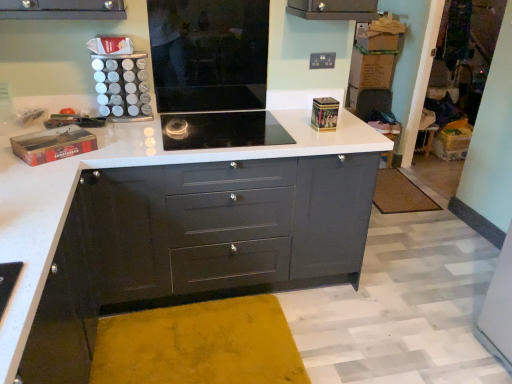
The image size is (512, 384). I want to click on brown textured mat at lower right, so click(x=400, y=194).

I want to click on black glass cooktop at center, so click(209, 54).

Measure the distance between point [323,209] and camera.

2.08 meters.

At what (x,y) coordinates should I click in order to perform the action: click on black glass cooktop at center. Please return your answer as a coordinate pair (x, y). Looking at the image, I should click on (222, 130).

Locate an element on the screen. This screenshot has height=384, width=512. brown textured mat at lower right is located at coordinates (400, 194).

Is matte black chest of drawers at center thinner than brown textured mat at lower right?

No, matte black chest of drawers at center is not thinner than brown textured mat at lower right.

Is matte black chest of drawers at center at the left side of brown textured mat at lower right?

Indeed, matte black chest of drawers at center is positioned on the left side of brown textured mat at lower right.

From the image's perspective, is matte black chest of drawers at center located above brown textured mat at lower right?

No, from the image's perspective, matte black chest of drawers at center is not above brown textured mat at lower right.

Is matte black chest of drawers at center directly adjacent to brown textured mat at lower right?

No, matte black chest of drawers at center is not next to brown textured mat at lower right.

Is black glass cooktop at center completely or partially outside of black glass cooktop at center?

That's correct, black glass cooktop at center is outside of black glass cooktop at center.

From the image's perspective, between black glass cooktop at center and black glass cooktop at center, which one is located above?

From the image's view, black glass cooktop at center is above.

Looking at the image, does black glass cooktop at center seem bigger or smaller compared to black glass cooktop at center?

In the image, black glass cooktop at center appears to be smaller than black glass cooktop at center.

Which is closer, (x=244, y=123) or (x=181, y=42)?

Clearly, point (x=244, y=123) is more distant from the camera than point (x=181, y=42).

The height and width of the screenshot is (384, 512). I want to click on chest of drawers below the black glass cooktop at center (from a real-world perspective), so click(195, 244).

Is black glass cooktop at center inside or outside of matte black chest of drawers at center?

The correct answer is: outside.

Does black glass cooktop at center have a larger size compared to matte black chest of drawers at center?

Incorrect, black glass cooktop at center is not larger than matte black chest of drawers at center.

Is black glass cooktop at center facing towards matte black chest of drawers at center?

No.

Is brown textured mat at lower right positioned far away from black glass cooktop at center?

Yes, brown textured mat at lower right and black glass cooktop at center are quite far apart.

In the scene shown: Is brown textured mat at lower right wider than black glass cooktop at center?

Correct, the width of brown textured mat at lower right exceeds that of black glass cooktop at center.

From the image's perspective, is black glass cooktop at center under black glass cooktop at center?

No, from the image's perspective, black glass cooktop at center is not beneath black glass cooktop at center.

This screenshot has height=384, width=512. I want to click on appliance located above the black glass cooktop at center (from the image's perspective), so click(209, 54).

Looking at their sizes, would you say black glass cooktop at center is wider or thinner than black glass cooktop at center?

In the image, black glass cooktop at center appears to be more narrow than black glass cooktop at center.

Which is more to the right, matte black chest of drawers at center or black glass cooktop at center?

matte black chest of drawers at center is more to the right.

Is matte black chest of drawers at center not inside black glass cooktop at center?

matte black chest of drawers at center is positioned outside black glass cooktop at center.

What's the angular difference between matte black chest of drawers at center and black glass cooktop at center's facing directions?

90.1 degrees separate the facing orientations of matte black chest of drawers at center and black glass cooktop at center.

From the image's perspective, between matte black chest of drawers at center and black glass cooktop at center, who is located below?

From the image's view, matte black chest of drawers at center is below.

In order to click on appliance above the brown textured mat at lower right (from a real-world perspective) in this screenshot , I will do `click(209, 54)`.

From a real-world perspective, between black glass cooktop at center and brown textured mat at lower right, who is vertically higher?

black glass cooktop at center.

Where is `mat on the right of matte black chest of drawers at center`? mat on the right of matte black chest of drawers at center is located at coordinates (400, 194).

Locate an element on the screen. The width and height of the screenshot is (512, 384). home appliance in front of the black glass cooktop at center is located at coordinates (222, 130).

Considering their positions, is black glass cooktop at center positioned further to black glass cooktop at center than brown textured mat at lower right?

brown textured mat at lower right is positioned further to the anchor black glass cooktop at center.

When comparing their distances from brown textured mat at lower right, does black glass cooktop at center or black glass cooktop at center seem closer?

Based on the image, black glass cooktop at center appears to be nearer to brown textured mat at lower right.

Which object lies further to the anchor point black glass cooktop at center, black glass cooktop at center or brown textured mat at lower right?

Based on the image, brown textured mat at lower right appears to be further to black glass cooktop at center.

Estimate the real-world distances between objects in this image. Which object is further from brown textured mat at lower right, black glass cooktop at center or matte black chest of drawers at center?

Based on the image, black glass cooktop at center appears to be further to brown textured mat at lower right.

Estimate the real-world distances between objects in this image. Which object is further from matte black chest of drawers at center, brown textured mat at lower right or black glass cooktop at center?

Among the two, brown textured mat at lower right is located further to matte black chest of drawers at center.

Considering their positions, is matte black chest of drawers at center positioned closer to black glass cooktop at center than black glass cooktop at center?

Based on the image, black glass cooktop at center appears to be nearer to black glass cooktop at center.

From the picture: Based on their spatial positions, is matte black chest of drawers at center or brown textured mat at lower right further from black glass cooktop at center?

brown textured mat at lower right is further to black glass cooktop at center.

Looking at the image, which one is located closer to black glass cooktop at center, brown textured mat at lower right or matte black chest of drawers at center?

matte black chest of drawers at center lies closer to black glass cooktop at center than the other object.

At what (x,y) coordinates should I click in order to perform the action: click on home appliance between matte black chest of drawers at center and black glass cooktop at center along the z-axis. Please return your answer as a coordinate pair (x, y). Image resolution: width=512 pixels, height=384 pixels. Looking at the image, I should click on (222, 130).

The image size is (512, 384). I want to click on appliance between matte black chest of drawers at center and brown textured mat at lower right in the front-back direction, so click(x=209, y=54).

In order to click on home appliance between black glass cooktop at center and brown textured mat at lower right from left to right in this screenshot , I will do `click(222, 130)`.

Identify the location of home appliance positioned between matte black chest of drawers at center and brown textured mat at lower right from near to far. click(x=222, y=130).